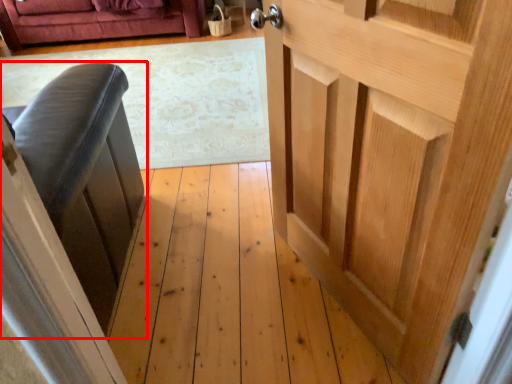
Question: From the image's perspective, where is furniture (annotated by the red box) located relative to door?

Choices:
 (A) above
 (B) below

Answer: (A)